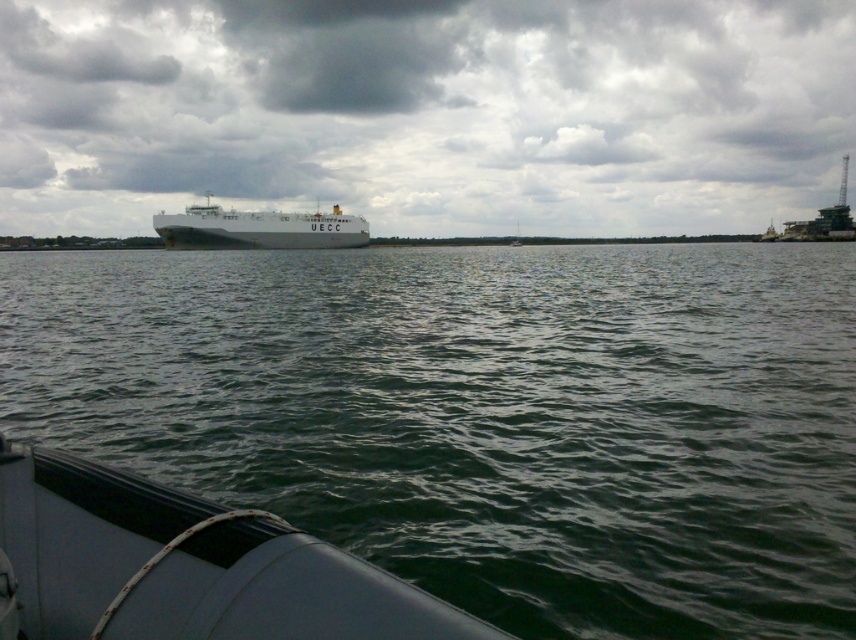
Question: Can you confirm if greenish water at center is smaller than gray cloudy sky at upper center?

Choices:
 (A) yes
 (B) no

Answer: (A)

Question: Which object is positioned farthest from the white matte boat at lower left?

Choices:
 (A) greenish water at center
 (B) white matte ship at center
 (C) gray cloudy sky at upper center

Answer: (C)

Question: Which point is farther to the camera?

Choices:
 (A) (82, 614)
 (B) (21, 275)
 (C) (278, 26)

Answer: (C)

Question: From the image, what is the correct spatial relationship of greenish water at center in relation to gray cloudy sky at upper center?

Choices:
 (A) right
 (B) left

Answer: (B)

Question: Is gray cloudy sky at upper center above white matte ship at center?

Choices:
 (A) no
 (B) yes

Answer: (B)

Question: Considering the real-world distances, which object is farthest from the greenish water at center?

Choices:
 (A) white matte ship at center
 (B) white matte boat at lower left

Answer: (A)